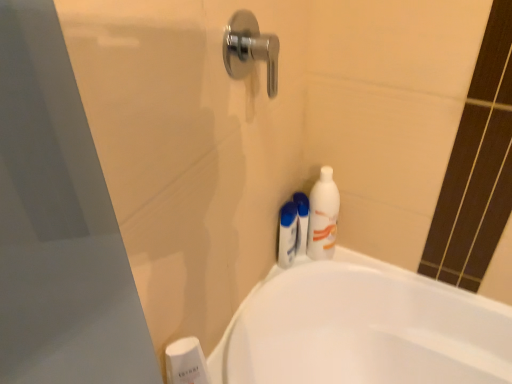
Question: Considering their positions, is white matte shaving cream at upper right located in front of or behind white matte bottle at right?

Choices:
 (A) behind
 (B) front

Answer: (A)

Question: Is white matte shaving cream at upper right wider or thinner than white matte bottle at right?

Choices:
 (A) thin
 (B) wide

Answer: (A)

Question: Based on their relative distances, which object is farther from the white glossy bathtub at lower right?

Choices:
 (A) chrome metallic door handle at upper center
 (B) white plastic soap dispenser at lower left, arranged as the 1th toiletry when viewed from the front
 (C) white plastic shampoo bottle at upper center, the first toiletry when ordered from back to front
 (D) white matte shaving cream at upper right
 (E) white matte bottle at right

Answer: (A)

Question: Estimate the real-world distances between objects in this image. Which object is closer to the white matte shaving cream at upper right?

Choices:
 (A) white plastic shampoo bottle at upper center, the 2th toiletry ordered from the bottom
 (B) white matte bottle at right
 (C) chrome metallic door handle at upper center
 (D) white plastic soap dispenser at lower left, the first toiletry positioned from the left
 (E) white glossy bathtub at lower right

Answer: (A)